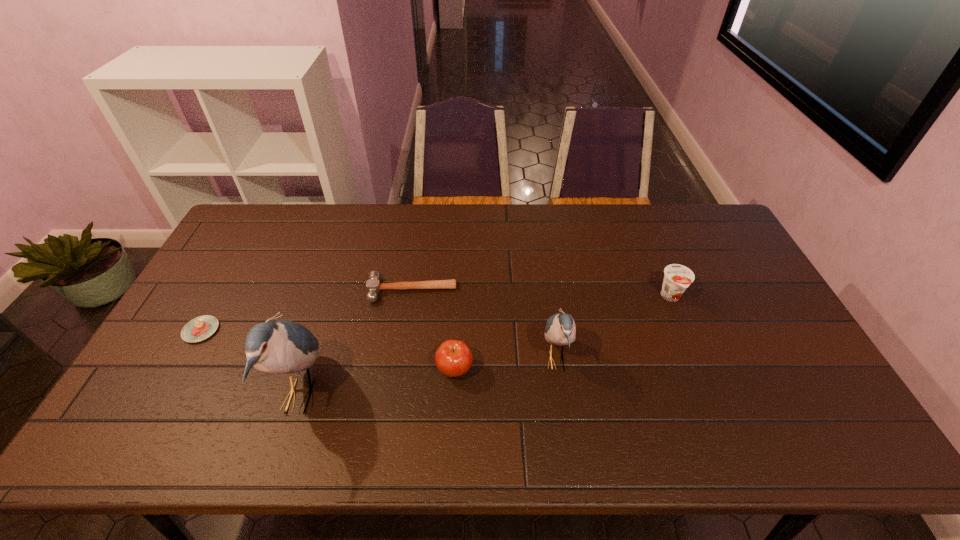
Where is `free spot between the apple and the taller bird`? The image size is (960, 540). free spot between the apple and the taller bird is located at coordinates 377,382.

The width and height of the screenshot is (960, 540). What are the coordinates of `free space between the left bird and the second shortest object` in the screenshot? It's located at (356, 343).

I want to click on object that is the third closest one to the hammer, so tap(560, 329).

Select which object appears as the fourth closest to the shortest object. Please provide its 2D coordinates. Your answer should be formatted as a tuple, i.e. [(x, y)], where the tuple contains the x and y coordinates of a point satisfying the conditions above.

[(560, 329)]

You are a GUI agent. You are given a task and a screenshot of the screen. Output one action in this format:
    pyautogui.click(x=<x>, y=<y>)
    Task: Click on the free space that satisfies the following two spatial constraints: 1. on the back side of the hammer; 2. on the left side of the shortest object
    
    Given the screenshot: What is the action you would take?
    pyautogui.click(x=223, y=291)

Where is `vacant area that satisfies the following two spatial constraints: 1. on the back side of the yogurt; 2. on the left side of the pastry`? Image resolution: width=960 pixels, height=540 pixels. vacant area that satisfies the following two spatial constraints: 1. on the back side of the yogurt; 2. on the left side of the pastry is located at coordinates (220, 297).